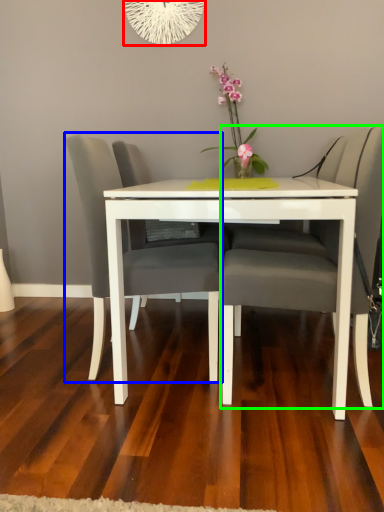
Question: Which is nearer to the oval (highlighted by a red box)? chair (highlighted by a blue box) or chair (highlighted by a green box).

Choices:
 (A) chair
 (B) chair

Answer: (A)